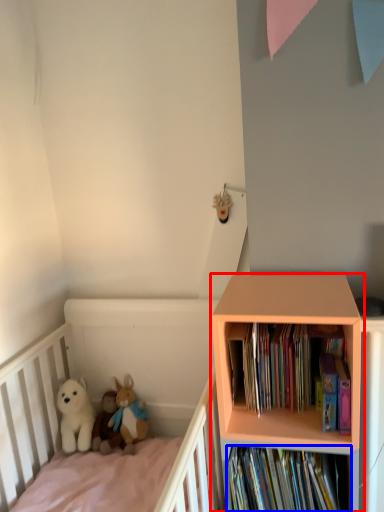
Question: Which of the following is the closest to the observer, bookcase (highlighted by a red box) or book (highlighted by a blue box)?

Choices:
 (A) bookcase
 (B) book

Answer: (A)